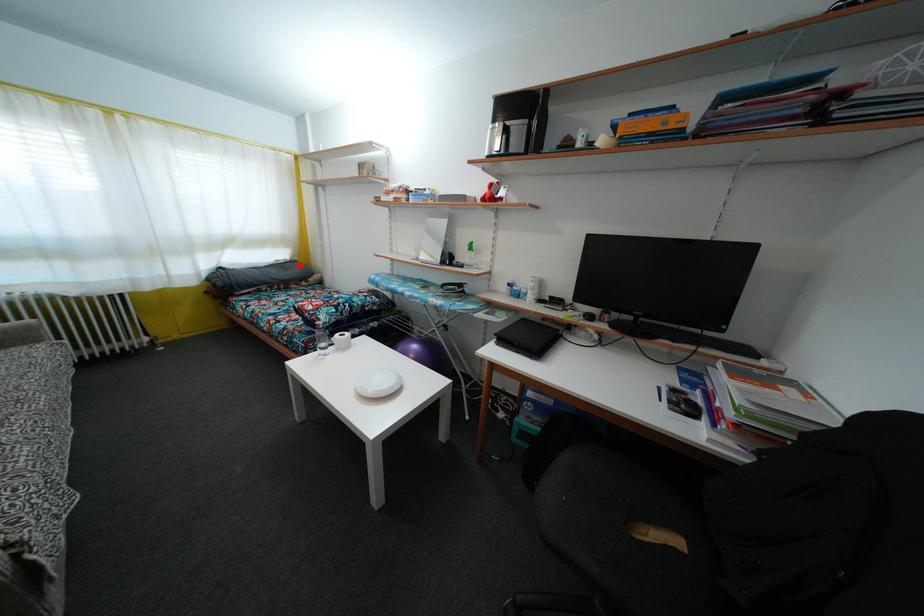
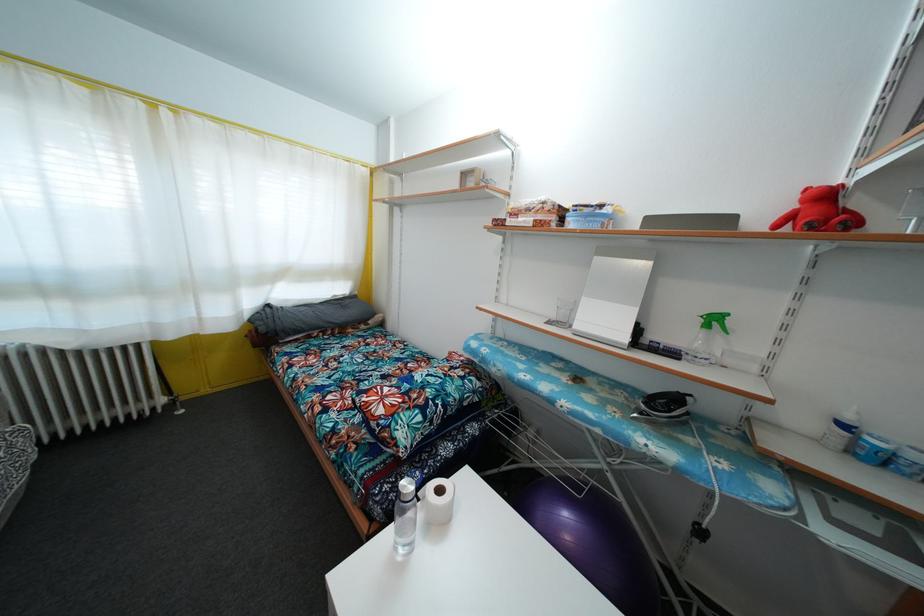
Question: I am providing you with two images of the same scene from different viewpoints. Given a red point in image1, look at the same physical point in image2. Is it:

Choices:
 (A) Closer to the viewpoint
 (B) Farther from the viewpoint

Answer: (B)